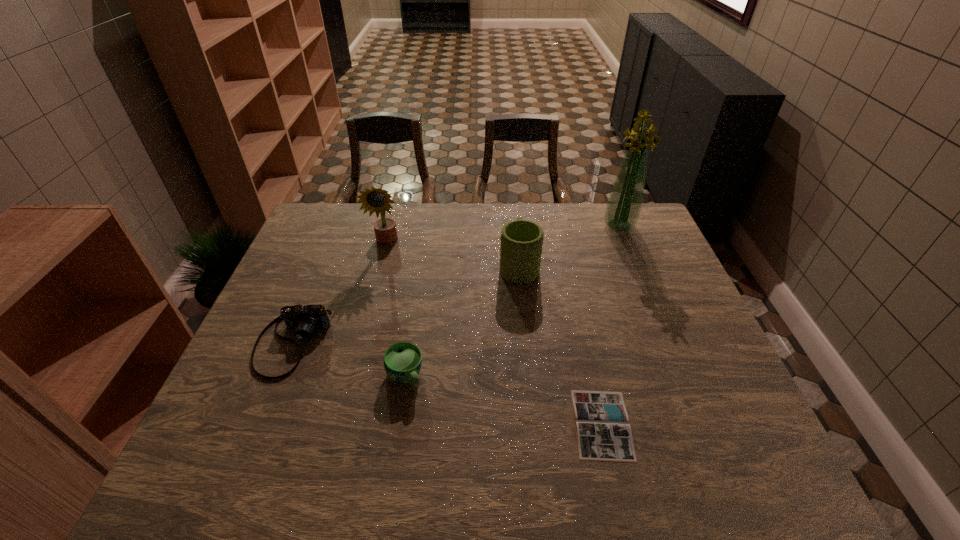
This screenshot has height=540, width=960. I want to click on object that is the nearest to the camera, so click(x=402, y=361).

Find the location of a particular element. vacant point that satisfies the following two spatial constraints: 1. on the face of the third object from left to right; 2. on the right side of the second tallest object is located at coordinates (352, 376).

Find the location of `free space in the image that satisfies the following two spatial constraints: 1. on the face of the fourth object from right to left; 2. on the left side of the fifth object from right to left`. free space in the image that satisfies the following two spatial constraints: 1. on the face of the fourth object from right to left; 2. on the left side of the fifth object from right to left is located at coordinates 352,376.